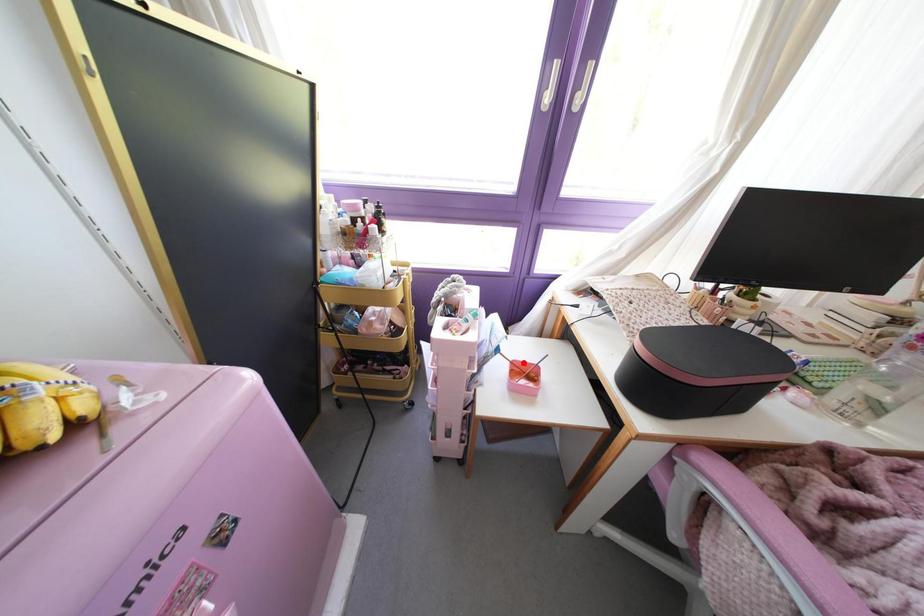
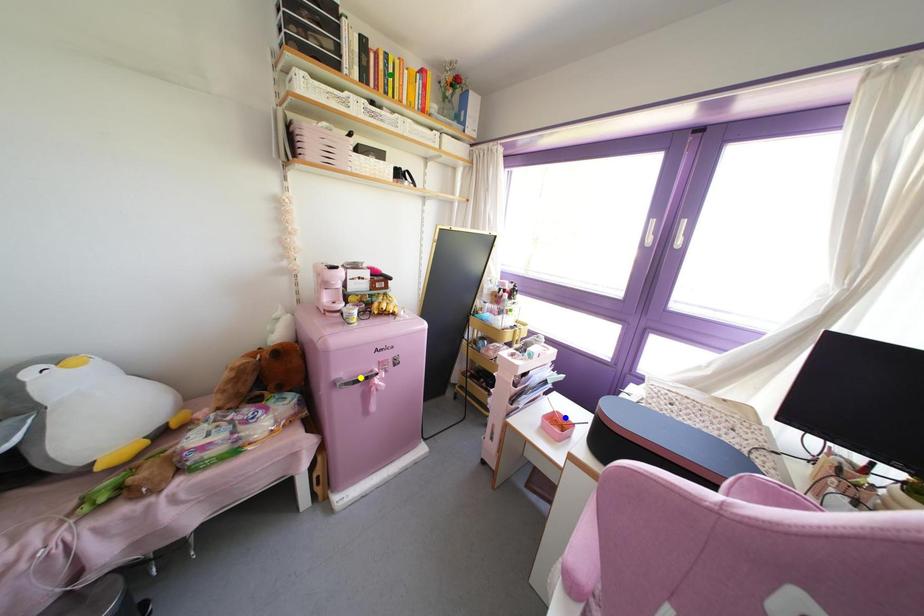
Question: I am providing you with two images of the same scene from different viewpoints. A red point is marked on the first image. You are given multiple points on the second image. Can you choose the point in image 2 that corresponds to the point in image 1?

Choices:
 (A) green point
 (B) yellow point
 (C) blue point

Answer: (C)